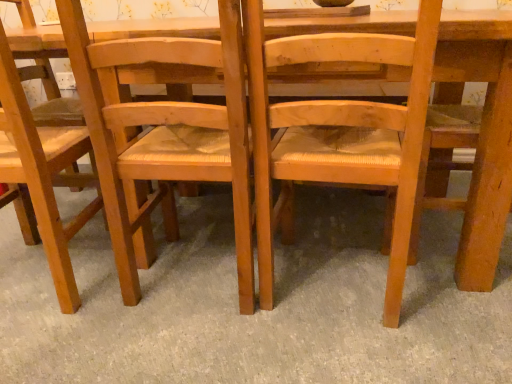
Image resolution: width=512 pixels, height=384 pixels. I want to click on free space to the back side of wooden woven seat at center, the second chair in the left-to-right sequence, so pos(211,213).